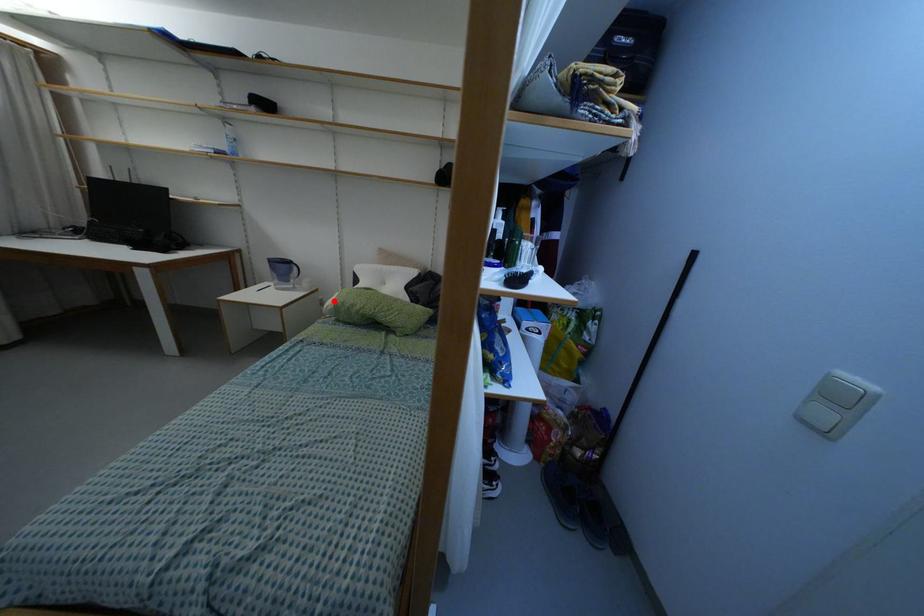
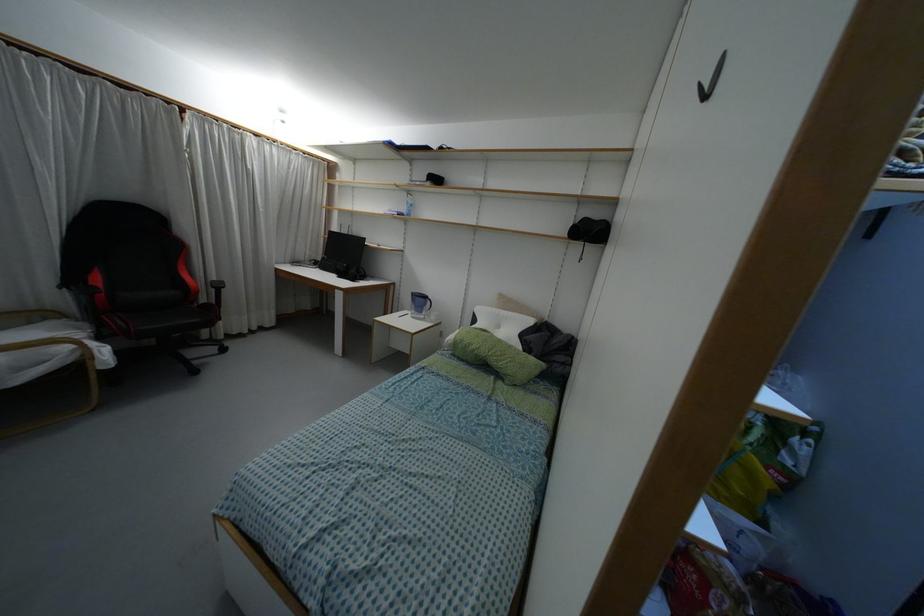
Where in the second image is the point corresponding to the highlighted location from the first image?

(455, 337)